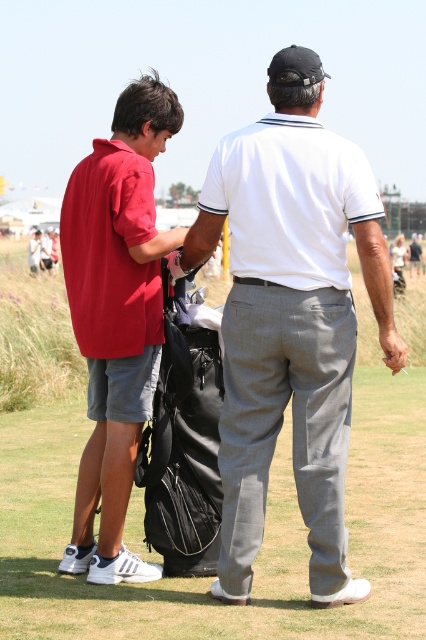
Question: Which point is closer to the camera?

Choices:
 (A) (351, 147)
 (B) (9, 515)

Answer: (A)

Question: Is white cotton polo shirt at center bigger than matte red polo shirt at left?

Choices:
 (A) no
 (B) yes

Answer: (A)

Question: Observing the image, what is the correct spatial positioning of matte red polo shirt at left in reference to black fabric golf bag at center?

Choices:
 (A) above
 (B) below

Answer: (A)

Question: Which point is farther from the camera taking this photo?

Choices:
 (A) (74, 400)
 (B) (235, 435)
 (C) (117, 362)
 (D) (147, 472)

Answer: (A)

Question: From the image, what is the correct spatial relationship of matte red polo shirt at left in relation to black fabric golf bag at center?

Choices:
 (A) right
 (B) left

Answer: (B)

Question: Which point is farther to the camera?

Choices:
 (A) (104, 200)
 (B) (183, 484)
 (C) (226, 550)
 (D) (164, 616)

Answer: (B)